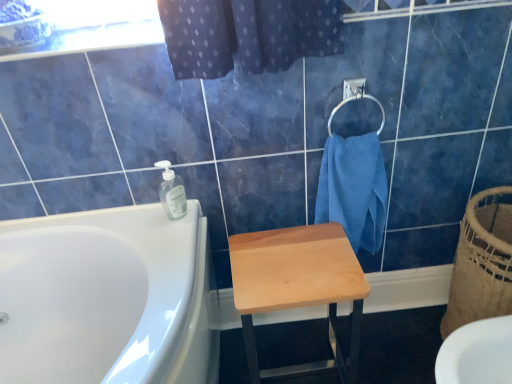
What do you see at coordinates (481, 263) in the screenshot? The height and width of the screenshot is (384, 512). I see `natural woven basket at right` at bounding box center [481, 263].

What is the approximate height of blue cotton towel at upper right?

The height of blue cotton towel at upper right is 15.54 inches.

Where is `silver metallic towel bar at upper right`? silver metallic towel bar at upper right is located at coordinates (355, 99).

Identify the location of clear plastic soap dispenser at upper center. (172, 192).

At what (x,y) coordinates should I click in order to perform the action: click on natural wood stool at center. Please return your answer as a coordinate pair (x, y). This screenshot has width=512, height=384. Looking at the image, I should click on (298, 286).

Measure the distance between natural woven basket at right and natural wood stool at center.

They are 17.28 inches apart.

Is natural woven basket at right facing towards natural wood stool at center?

Yes.

Where is `basket that is above the natural wood stool at center (from the image's perspective)`? basket that is above the natural wood stool at center (from the image's perspective) is located at coordinates (481, 263).

Does point (501, 229) lie behind point (338, 292)?

Yes.

Locate an element on the screen. soap dispenser located above the natural wood stool at center (from the image's perspective) is located at coordinates (172, 192).

Is natural wood stool at center taller or shorter than clear plastic soap dispenser at upper center?

natural wood stool at center is taller than clear plastic soap dispenser at upper center.

Is natural wood stool at center next to clear plastic soap dispenser at upper center?

No, natural wood stool at center is not touching clear plastic soap dispenser at upper center.

Considering their positions, is natural wood stool at center located in front of or behind clear plastic soap dispenser at upper center?

In the image, natural wood stool at center appears in front of clear plastic soap dispenser at upper center.

Is natural woven basket at right positioned far away from clear plastic soap dispenser at upper center?

Actually, natural woven basket at right and clear plastic soap dispenser at upper center are a little close together.

Which is more to the left, natural woven basket at right or clear plastic soap dispenser at upper center?

clear plastic soap dispenser at upper center is more to the left.

Is point (455, 309) farther from camera compared to point (182, 212)?

Yes.

Relative to clear plastic soap dispenser at upper center, is natural woven basket at right in front or behind?

Clearly, natural woven basket at right is in front of clear plastic soap dispenser at upper center.

Considering the relative positions of transparent glass window screen at upper left and blue cotton towel at upper right in the image provided, is transparent glass window screen at upper left in front of blue cotton towel at upper right?

Yes, the depth of transparent glass window screen at upper left is less than that of blue cotton towel at upper right.

How much distance is there between transparent glass window screen at upper left and blue cotton towel at upper right?

transparent glass window screen at upper left is 26.07 inches away from blue cotton towel at upper right.

From a real-world perspective, who is located higher, transparent glass window screen at upper left or blue cotton towel at upper right?

From a 3D spatial view, transparent glass window screen at upper left is above.

Is point (128, 6) positioned after point (352, 179)?

No.

Who is bigger, silver metallic towel bar at upper right or transparent glass window screen at upper left?

transparent glass window screen at upper left.

Can you tell me how much silver metallic towel bar at upper right and transparent glass window screen at upper left differ in facing direction?

The facing directions of silver metallic towel bar at upper right and transparent glass window screen at upper left are 0.604 degrees apart.

Which point is more forward, (x=347, y=102) or (x=81, y=6)?

The point (x=347, y=102) is more forward.

Is silver metallic towel bar at upper right looking in the opposite direction of transparent glass window screen at upper left?

No, silver metallic towel bar at upper right is not facing away from transparent glass window screen at upper left.

At what (x,y) coordinates should I click in order to perform the action: click on window screen on the left side of silver metallic towel bar at upper right. Please return your answer as a coordinate pair (x, y). Image resolution: width=512 pixels, height=384 pixels. Looking at the image, I should click on (93, 27).

Is transparent glass window screen at upper left wider than silver metallic towel bar at upper right?

Correct, the width of transparent glass window screen at upper left exceeds that of silver metallic towel bar at upper right.

Considering the points (161, 35) and (384, 112), which point is behind, point (161, 35) or point (384, 112)?

The point (384, 112) is farther from the camera.

From the image's perspective, which object appears higher, transparent glass window screen at upper left or silver metallic towel bar at upper right?

transparent glass window screen at upper left is shown above in the image.

Find the location of a particular element. The height and width of the screenshot is (384, 512). towel bar that is on the left side of blue cotton towel at upper right is located at coordinates (355, 99).

Between silver metallic towel bar at upper right and blue cotton towel at upper right, which one has smaller width?

silver metallic towel bar at upper right is thinner.

Is silver metallic towel bar at upper right taller than blue cotton towel at upper right?

Incorrect, the height of silver metallic towel bar at upper right is not larger of that of blue cotton towel at upper right.

In order to click on stool to the left of natural woven basket at right in this screenshot , I will do `click(298, 286)`.

Identify the location of soap dispenser positioned vertically above the natural wood stool at center (from a real-world perspective). (172, 192).

Which object lies further to the anchor point natural wood stool at center, blue cotton towel at upper right or clear plastic soap dispenser at upper center?

clear plastic soap dispenser at upper center.

When comparing their distances from blue cotton towel at upper right, does transparent glass window screen at upper left or natural woven basket at right seem closer?

natural woven basket at right is positioned closer to the anchor blue cotton towel at upper right.

Considering their positions, is clear plastic soap dispenser at upper center positioned closer to transparent glass window screen at upper left than blue cotton towel at upper right?

clear plastic soap dispenser at upper center.

From the image, which object appears to be farther from natural wood stool at center, silver metallic towel bar at upper right or transparent glass window screen at upper left?

Among the two, transparent glass window screen at upper left is located further to natural wood stool at center.

Looking at the image, which one is located further to natural wood stool at center, blue cotton towel at upper right or natural woven basket at right?

Among the two, natural woven basket at right is located further to natural wood stool at center.

Estimate the real-world distances between objects in this image. Which object is closer to natural wood stool at center, clear plastic soap dispenser at upper center or natural woven basket at right?

clear plastic soap dispenser at upper center.

Based on the photo, based on their spatial positions, is silver metallic towel bar at upper right or blue cotton towel at upper right further from transparent glass window screen at upper left?

The object further to transparent glass window screen at upper left is blue cotton towel at upper right.

When comparing their distances from blue cotton towel at upper right, does natural woven basket at right or silver metallic towel bar at upper right seem closer?

silver metallic towel bar at upper right.

At what (x,y) coordinates should I click in order to perform the action: click on soap dispenser that lies between transparent glass window screen at upper left and natural wood stool at center from top to bottom. Please return your answer as a coordinate pair (x, y). Looking at the image, I should click on (172, 192).

I want to click on soap dispenser between transparent glass window screen at upper left and silver metallic towel bar at upper right from left to right, so click(x=172, y=192).

The image size is (512, 384). I want to click on stool between clear plastic soap dispenser at upper center and blue cotton towel at upper right, so click(x=298, y=286).

The height and width of the screenshot is (384, 512). Find the location of `stool located between transparent glass window screen at upper left and natural woven basket at right in the left-right direction`. stool located between transparent glass window screen at upper left and natural woven basket at right in the left-right direction is located at coordinates point(298,286).